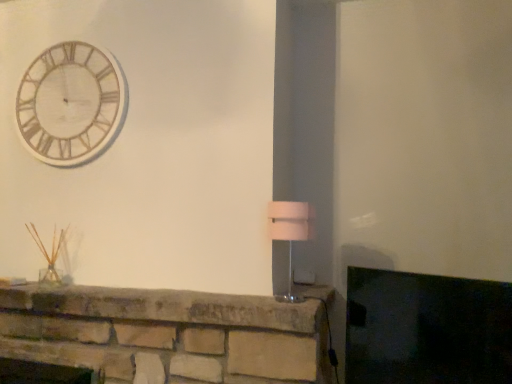
Question: Is matte stone fireplace at lower left thinner than wooden/textured clock at upper left?

Choices:
 (A) no
 (B) yes

Answer: (A)

Question: Is wooden/textured clock at upper left at the back of matte stone fireplace at lower left?

Choices:
 (A) yes
 (B) no

Answer: (B)

Question: Is matte stone fireplace at lower left outside of wooden/textured clock at upper left?

Choices:
 (A) no
 (B) yes

Answer: (B)

Question: Can you confirm if matte stone fireplace at lower left is shorter than wooden/textured clock at upper left?

Choices:
 (A) no
 (B) yes

Answer: (B)

Question: Does matte stone fireplace at lower left touch wooden/textured clock at upper left?

Choices:
 (A) yes
 (B) no

Answer: (B)

Question: Is matte stone fireplace at lower left taller or shorter than wooden/textured clock at upper left?

Choices:
 (A) short
 (B) tall

Answer: (A)

Question: Is point (498, 347) closer or farther from the camera than point (47, 102)?

Choices:
 (A) farther
 (B) closer

Answer: (B)

Question: From the image's perspective, is matte stone fireplace at lower left above or below wooden/textured clock at upper left?

Choices:
 (A) above
 (B) below

Answer: (B)

Question: In the image, is matte stone fireplace at lower left on the left side or the right side of wooden/textured clock at upper left?

Choices:
 (A) left
 (B) right

Answer: (B)

Question: Is white fabric lampshade at right inside the boundaries of wooden/textured clock at upper left, or outside?

Choices:
 (A) inside
 (B) outside

Answer: (B)

Question: From the image's perspective, is white fabric lampshade at right above or below wooden/textured clock at upper left?

Choices:
 (A) below
 (B) above

Answer: (A)

Question: Is point (310, 235) closer or farther from the camera than point (121, 92)?

Choices:
 (A) closer
 (B) farther

Answer: (A)

Question: Looking at the image, does white fabric lampshade at right seem bigger or smaller compared to wooden/textured clock at upper left?

Choices:
 (A) big
 (B) small

Answer: (B)

Question: Does point (433, 301) appear closer or farther from the camera than point (307, 203)?

Choices:
 (A) farther
 (B) closer

Answer: (B)

Question: Considering their positions, is matte stone fireplace at lower left located in front of or behind white fabric lampshade at right?

Choices:
 (A) behind
 (B) front

Answer: (B)